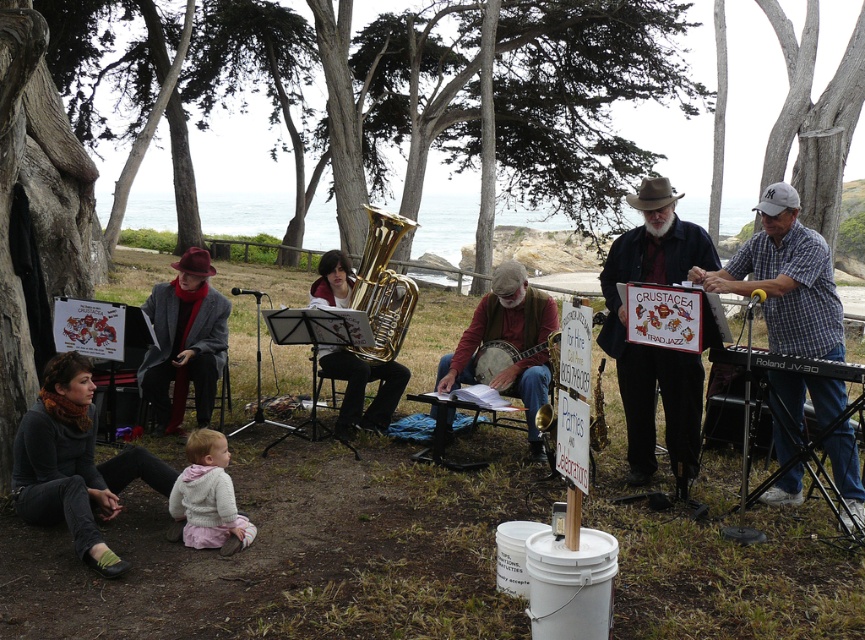
Does white checkered shirt at right have a greater width compared to wooden banjo at center?

Yes.

Does white checkered shirt at right come behind wooden banjo at center?

That is False.

Is point (834, 292) more distant than point (507, 340)?

No.

Identify the location of white checkered shirt at right. Image resolution: width=865 pixels, height=640 pixels. (785, 280).

Is dark gray sweater at lower left bigger than matte gray coat at left?

No.

Who is positioned more to the left, dark gray sweater at lower left or matte gray coat at left?

Positioned to the left is matte gray coat at left.

Is point (81, 488) farther from viewer compared to point (204, 304)?

No, it is in front of (204, 304).

Find the location of a particular element. dark gray sweater at lower left is located at coordinates (75, 464).

Does matte gray coat at left have a lesser width compared to black plastic keyboard at right?

Correct, matte gray coat at left's width is less than black plastic keyboard at right's.

Between point (208, 401) and point (785, 362), which one is positioned behind?

The point (208, 401) is more distant.

Locate an element on the screen. This screenshot has width=865, height=640. matte gray coat at left is located at coordinates (184, 340).

Locate an element on the screen. The width and height of the screenshot is (865, 640). matte gray coat at left is located at coordinates (184, 340).